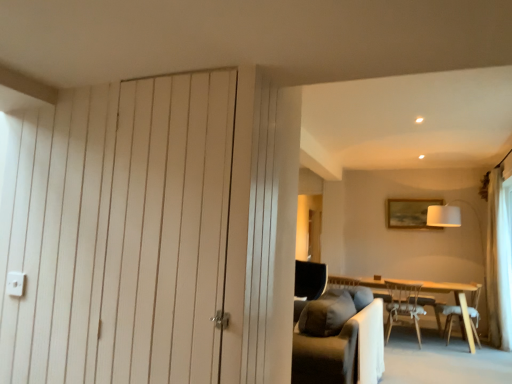
Question: Is light wood table at center aimed at white fabric lampshade at upper right?

Choices:
 (A) no
 (B) yes

Answer: (A)

Question: Is light wood table at center wider than white fabric lampshade at upper right?

Choices:
 (A) no
 (B) yes

Answer: (A)

Question: Is light wood table at center smaller than white fabric lampshade at upper right?

Choices:
 (A) no
 (B) yes

Answer: (B)

Question: From the image's perspective, would you say light wood table at center is shown under white fabric lampshade at upper right?

Choices:
 (A) no
 (B) yes

Answer: (B)

Question: Is the depth of light wood table at center less than that of white fabric lampshade at upper right?

Choices:
 (A) no
 (B) yes

Answer: (B)

Question: From the image's perspective, is light brown wooden chair at lower right, the 1th chair viewed from the left, positioned above or below white wood door at left?

Choices:
 (A) above
 (B) below

Answer: (B)

Question: Considering the positions of light brown wooden chair at lower right, the 1th chair viewed from the left, and white wood door at left in the image, is light brown wooden chair at lower right, the 1th chair viewed from the left, wider or thinner than white wood door at left?

Choices:
 (A) thin
 (B) wide

Answer: (B)

Question: In the image, is light brown wooden chair at lower right, the 1th chair viewed from the left, positioned in front of or behind white wood door at left?

Choices:
 (A) front
 (B) behind

Answer: (B)

Question: Does point (415, 324) appear closer or farther from the camera than point (116, 137)?

Choices:
 (A) closer
 (B) farther

Answer: (B)

Question: From a real-world perspective, relative to light brown wooden chair at lower right, the 1th chair viewed from the left, is wooden chair at lower right, marked as the first chair in a right-to-left arrangement, vertically above or below?

Choices:
 (A) above
 (B) below

Answer: (B)

Question: From the image's perspective, is wooden chair at lower right, marked as the first chair in a right-to-left arrangement, located above or below light brown wooden chair at lower right, which is counted as the second chair, starting from the right?

Choices:
 (A) above
 (B) below

Answer: (B)

Question: Considering the positions of wooden chair at lower right, marked as the first chair in a right-to-left arrangement, and light brown wooden chair at lower right, the 1th chair viewed from the left, in the image, is wooden chair at lower right, marked as the first chair in a right-to-left arrangement, bigger or smaller than light brown wooden chair at lower right, the 1th chair viewed from the left,?

Choices:
 (A) big
 (B) small

Answer: (B)

Question: Is point (437, 304) positioned closer to the camera than point (390, 309)?

Choices:
 (A) farther
 (B) closer

Answer: (B)

Question: Relative to light wood table at center, is light brown wooden chair at lower right, the 1th chair viewed from the left, in front or behind?

Choices:
 (A) front
 (B) behind

Answer: (B)

Question: From a real-world perspective, is light brown wooden chair at lower right, which is counted as the second chair, starting from the right, positioned above or below light wood table at center?

Choices:
 (A) above
 (B) below

Answer: (A)